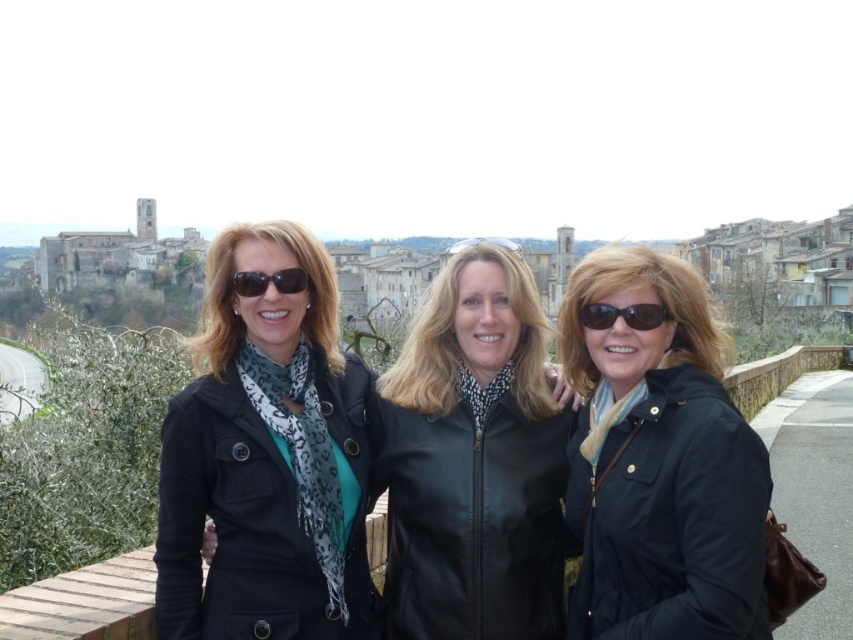
Looking at this image, who is shorter, matte black sunglasses at center or clear plastic goggles at center?

matte black sunglasses at center

Is the position of matte black sunglasses at center less distant than that of clear plastic goggles at center?

Yes.

This screenshot has height=640, width=853. Describe the element at coordinates (270, 282) in the screenshot. I see `matte black sunglasses at center` at that location.

The height and width of the screenshot is (640, 853). In order to click on matte black sunglasses at center in this screenshot , I will do `click(270, 282)`.

Which is in front, point (402, 560) or point (650, 321)?

Positioned in front is point (650, 321).

Is black leather jacket at center thinner than black plastic sunglasses at center?

No, black leather jacket at center is not thinner than black plastic sunglasses at center.

The width and height of the screenshot is (853, 640). What do you see at coordinates (474, 460) in the screenshot?
I see `black leather jacket at center` at bounding box center [474, 460].

Where is `black leather jacket at center`? black leather jacket at center is located at coordinates (474, 460).

Does matte black jacket at center lie in front of matte black sunglasses at center?

Yes, it is.

This screenshot has height=640, width=853. Describe the element at coordinates (659, 465) in the screenshot. I see `matte black jacket at center` at that location.

This screenshot has height=640, width=853. Identify the location of matte black jacket at center. (659, 465).